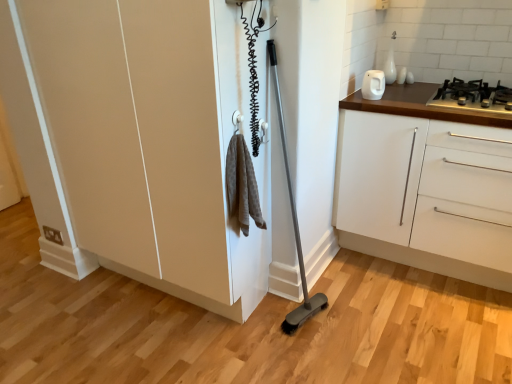
This screenshot has height=384, width=512. Identify the location of free space that is to the left of matte beige cupboard at center. (62, 316).